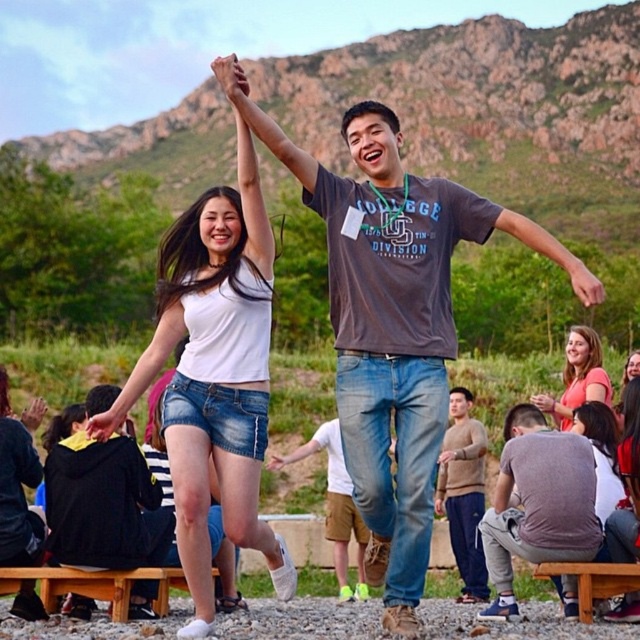
Question: Considering the real-world distances, which object is farthest from the matte white arm at upper center?

Choices:
 (A) knit sweater at center
 (B) smooth yellow cloth at center

Answer: (A)

Question: Can you confirm if jeans at center is positioned above smooth skin hand at center?

Choices:
 (A) no
 (B) yes

Answer: (A)

Question: In this image, where is knit sweater at center located relative to matte white hand at upper center?

Choices:
 (A) below
 (B) above

Answer: (A)

Question: Can you confirm if gray cotton t-shirt at lower right is smaller than smooth skin hand at center?

Choices:
 (A) yes
 (B) no

Answer: (B)

Question: Which object is positioned farthest from the white matte tank top at center?

Choices:
 (A) matte gray t-shirt at center
 (B) matte white hand at upper center
 (C) matte orange shirt at lower right
 (D) knit sweater at center

Answer: (C)

Question: Which of the following is the closest to the observer?

Choices:
 (A) (113, 432)
 (B) (592, 284)
 (C) (540, 396)

Answer: (B)